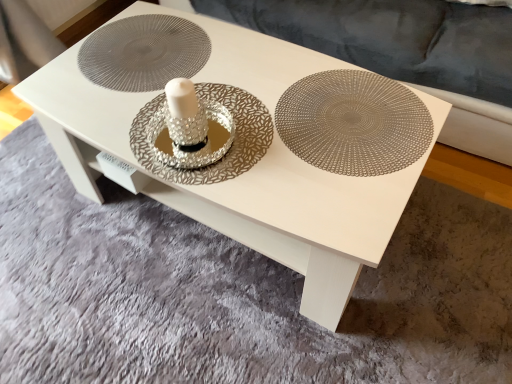
The image size is (512, 384). Find the location of `vacant space underneath metallic silver plate at center (from a real-world perspective)`. vacant space underneath metallic silver plate at center (from a real-world perspective) is located at coordinates (346, 123).